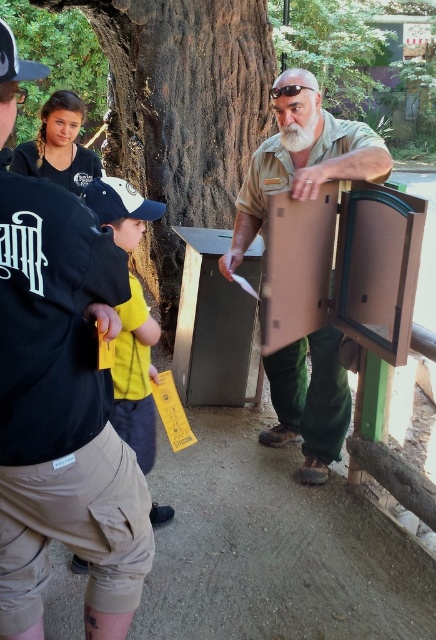
Is point (326, 381) in front of point (123, 220)?

No, it is behind (123, 220).

I want to click on matte brown suitcase at center, so click(302, 157).

From the picture: Who is taller, green leafy tree at center or white matte baseball cap at left?

Standing taller between the two is green leafy tree at center.

In the scene shown: Is green leafy tree at center further to camera compared to white matte baseball cap at left?

Yes, it is.

Which is behind, point (313, 33) or point (91, 182)?

The point (313, 33) is more distant.

Image resolution: width=436 pixels, height=640 pixels. I want to click on green leafy tree at center, so click(331, 49).

Does matte brown uniform at center appear under black fabric baseball cap at upper left?

Yes.

Between point (132, 566) and point (13, 76), which one is positioned in front?

Positioned in front is point (13, 76).

This screenshot has height=640, width=436. Identify the location of matte brown uniform at center. (62, 413).

Find the location of a particular element. The image size is (436, 640). matte brown uniform at center is located at coordinates (62, 413).